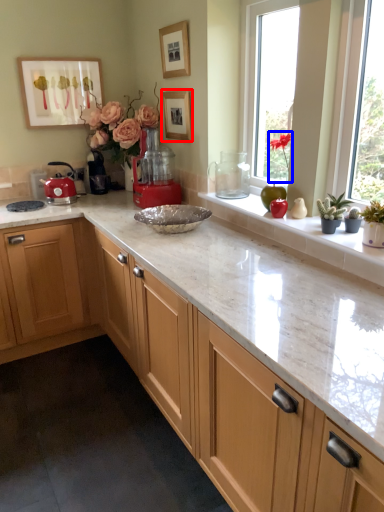
Question: Which point is closer to the camera, picture frame (highlighted by a red box) or plant (highlighted by a blue box)?

Choices:
 (A) picture frame
 (B) plant

Answer: (B)